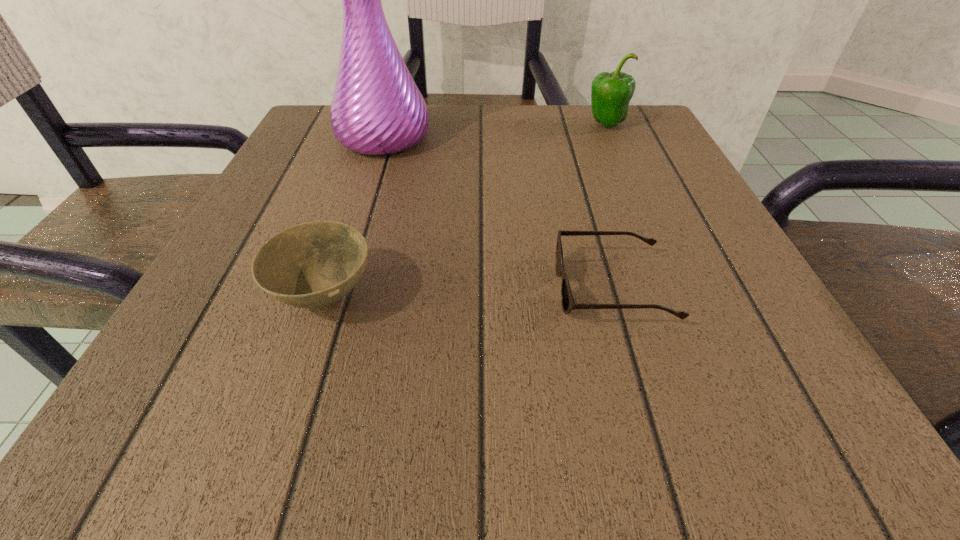
In order to click on vacant point located between the bowl and the tallest object in this screenshot , I will do `click(354, 217)`.

Image resolution: width=960 pixels, height=540 pixels. I want to click on empty space between the vase and the third tallest object, so click(354, 217).

Find the location of a particular element. This screenshot has width=960, height=540. vacant space that is in between the sunglasses and the bell pepper is located at coordinates 609,207.

Where is `vacant space that is in between the vase and the third tallest object`? vacant space that is in between the vase and the third tallest object is located at coordinates (354, 217).

I want to click on object that can be found as the closest to the tallest object, so click(312, 265).

Where is `object identified as the closest to the sunglasses`? This screenshot has width=960, height=540. object identified as the closest to the sunglasses is located at coordinates (312, 265).

At what (x,y) coordinates should I click in order to perform the action: click on free spot that satisfies the following two spatial constraints: 1. on the back side of the vase; 2. on the left side of the bell pepper. Please return your answer as a coordinate pair (x, y). The width and height of the screenshot is (960, 540). Looking at the image, I should click on (388, 124).

At what (x,y) coordinates should I click in order to perform the action: click on vacant space that satisfies the following two spatial constraints: 1. on the back side of the tallest object; 2. on the right side of the second tallest object. Please return your answer as a coordinate pair (x, y). The width and height of the screenshot is (960, 540). Looking at the image, I should click on (388, 124).

Where is `vacant region that satisfies the following two spatial constraints: 1. on the front side of the bell pepper; 2. on the front lenses of the shortest object`? vacant region that satisfies the following two spatial constraints: 1. on the front side of the bell pepper; 2. on the front lenses of the shortest object is located at coordinates (678, 289).

Find the location of a particular element. free region that satisfies the following two spatial constraints: 1. on the back side of the second shortest object; 2. on the right side of the bell pepper is located at coordinates (383, 124).